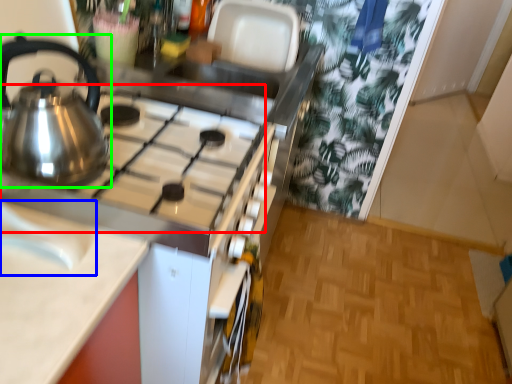
Question: Which object is the closest to the gas stove (highlighted by a red box)? Choose among these: sink (highlighted by a blue box) or kettle (highlighted by a green box).

Choices:
 (A) sink
 (B) kettle

Answer: (B)